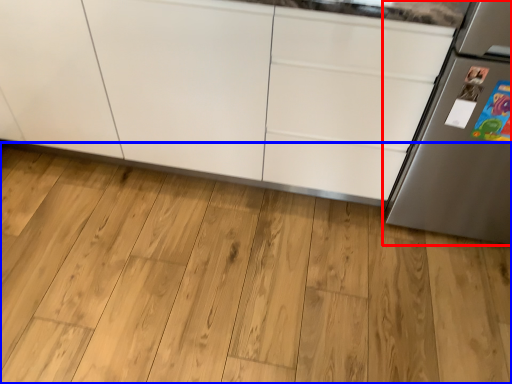
Question: Which object is further to the camera taking this photo, refrigerator (highlighted by a red box) or hardwood (highlighted by a blue box)?

Choices:
 (A) refrigerator
 (B) hardwood

Answer: (B)